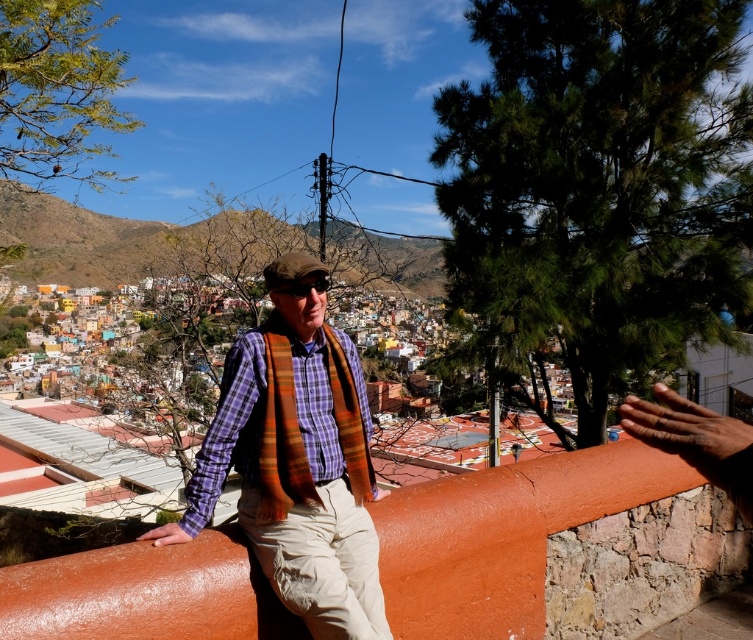
Question: Which object is positioned farthest from the green grassy hillside at upper left?

Choices:
 (A) orange rough stone wall at center
 (B) plaid cotton shirt at center

Answer: (A)

Question: Observing the image, what is the correct spatial positioning of plaid fabric shirt at center in reference to plaid cotton shirt at center?

Choices:
 (A) right
 (B) left

Answer: (A)

Question: Which point is closer to the camera?

Choices:
 (A) (104, 252)
 (B) (733, 460)
 (C) (294, 358)

Answer: (B)

Question: Which point appears closest to the camera in this image?

Choices:
 (A) (212, 442)
 (B) (258, 556)

Answer: (B)

Question: Can you confirm if plaid fabric shirt at center is positioned to the right of plaid cotton shirt at center?

Choices:
 (A) no
 (B) yes

Answer: (B)

Question: Can you confirm if green grassy hillside at upper left is thinner than orange rough stone wall at center?

Choices:
 (A) no
 (B) yes

Answer: (A)